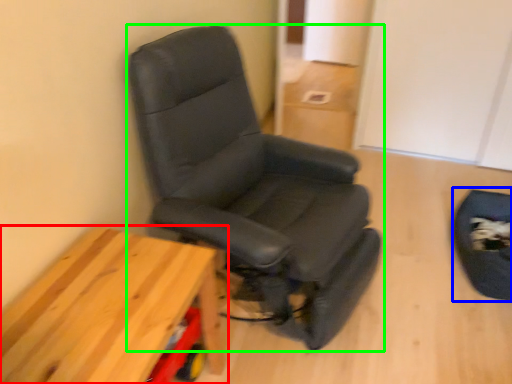
Question: Based on their relative distances, which object is farther from table (highlighted by a red box)? Choose from swivel chair (highlighted by a blue box) and chair (highlighted by a green box).

Choices:
 (A) swivel chair
 (B) chair

Answer: (A)